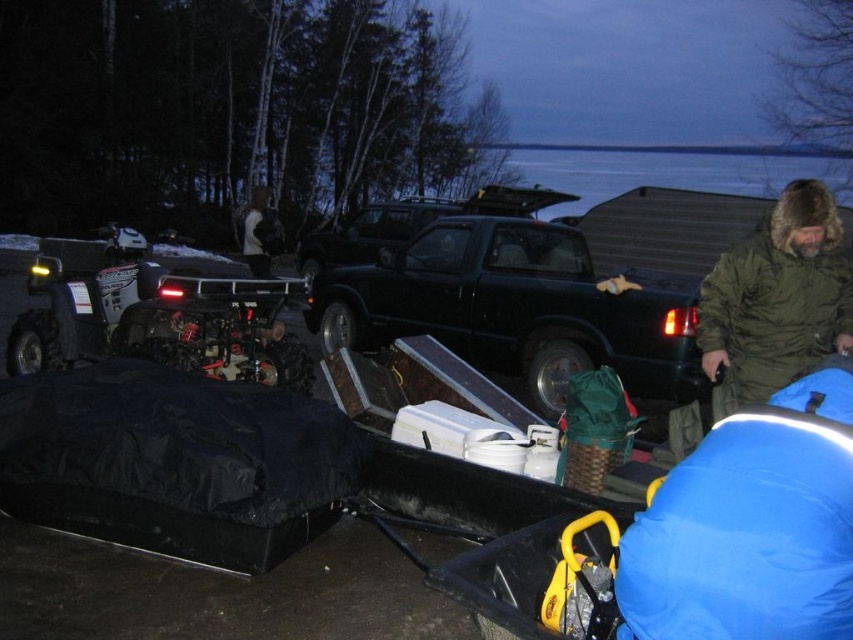
Looking at this image, you are a hiker who needs to decide whether to take the green fuzzy coat at right with you for the evening. The black matte quad bike at left is parked nearby. Considering the position of the quad bike, will the coat be visible from the quad bike driver seat?

The black matte quad bike at left is above the green fuzzy coat at right, so the driver sitting in the quad bike at left would have a higher vantage point. This means the driver can likely see the green fuzzy coat at right from their seat unless there is an obstruction. Since the scene is described as having dim light and the coat is fuzzy and possibly on the ground, it might still be visible depending on the exact placement. However, based on the given spatial information, the quad bike being above implies

You are planning to place a dark brown fur coat at upper center on the black matte truck at center. Based on their sizes, will the coat fit entirely on the truck bed without hanging off the sides?

The black matte truck at center is wider than the dark brown fur coat at upper center, so the coat will fit entirely on the truck bed without hanging off the sides.